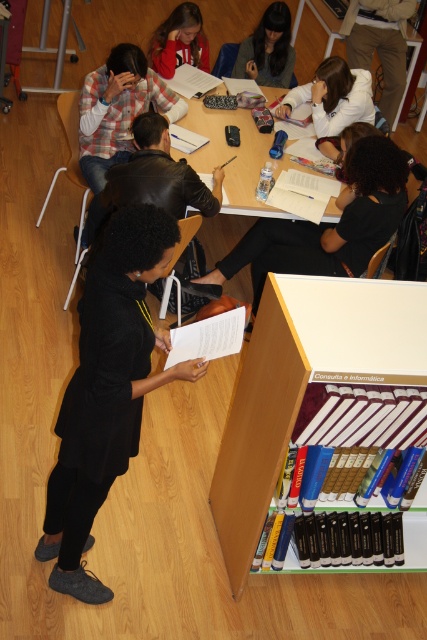
Who is more forward, (377, 42) or (318, 84)?

Point (318, 84) is in front.

Which is behind, point (356, 17) or point (327, 99)?

Positioned behind is point (356, 17).

Is point (377, 33) farther from camera compared to point (345, 109)?

Yes, point (377, 33) is farther from viewer.

Where is `dark brown leather jacket at upper center`? This screenshot has width=427, height=640. dark brown leather jacket at upper center is located at coordinates (380, 44).

Who is more distant from viewer, [266,316] or [111,134]?

Point [111,134]

How much distance is there between hardcover books at center and plaid fabric shirt at upper left?

They are 2.39 meters apart.

Locate an element on the screen. Image resolution: width=427 pixels, height=640 pixels. hardcover books at center is located at coordinates (257, 432).

Between black matte shirt at center and matte red hoodie at upper center, which one appears on the left side from the viewer's perspective?

From the viewer's perspective, matte red hoodie at upper center appears more on the left side.

The width and height of the screenshot is (427, 640). Describe the element at coordinates (328, 225) in the screenshot. I see `black matte shirt at center` at that location.

Is point (342, 228) farther from camera compared to point (163, 20)?

No, it is not.

Where is `black matte shirt at center`? Image resolution: width=427 pixels, height=640 pixels. black matte shirt at center is located at coordinates pos(328,225).